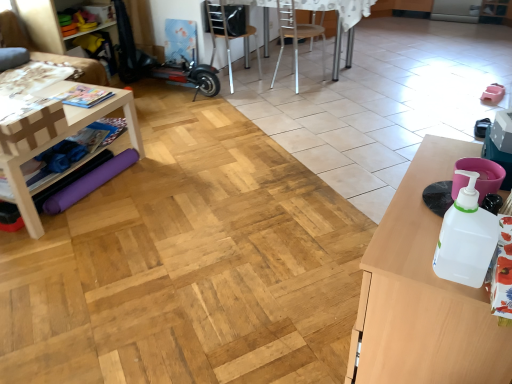
The width and height of the screenshot is (512, 384). Identify the location of brown fabric couch at left. (49, 53).

Identify the location of metallic silver table at center. (341, 8).

What is the approximate width of white wood table at left, marked as the first table in a back-to-front arrangement?

white wood table at left, marked as the first table in a back-to-front arrangement, is 21.96 inches in width.

Measure the distance between point (258, 61) and camera.

The depth of point (258, 61) is 4.50 meters.

Where is `white plastic bottle at right`? white plastic bottle at right is located at coordinates (466, 238).

Does point (447, 252) come behind point (93, 110)?

No, it is in front of (93, 110).

Where is `bottle in front of the white wood table at left, placed as the second table when sorted from right to left`? This screenshot has width=512, height=384. bottle in front of the white wood table at left, placed as the second table when sorted from right to left is located at coordinates (466, 238).

From the picture: Which of these two, white plastic bottle at right or white wood table at left, marked as the first table in a back-to-front arrangement, is smaller?

Smaller between the two is white plastic bottle at right.

Is white plastic bottle at right facing towards white wood table at left, marked as the first table in a back-to-front arrangement?

Yes, white plastic bottle at right is aimed at white wood table at left, marked as the first table in a back-to-front arrangement.

From a real-world perspective, is metallic silver chair at center, which ranks as the first chair in right-to-left order, beneath black plastic chair at center, the first chair in the left-to-right sequence?

Indeed, from a real-world perspective, metallic silver chair at center, which ranks as the first chair in right-to-left order, is positioned beneath black plastic chair at center, the first chair in the left-to-right sequence.

Does point (279, 0) come in front of point (212, 10)?

No, it is behind (212, 10).

Considering the sizes of metallic silver chair at center, which ranks as the first chair in right-to-left order, and black plastic chair at center, the first chair in the left-to-right sequence, in the image, is metallic silver chair at center, which ranks as the first chair in right-to-left order, taller or shorter than black plastic chair at center, the first chair in the left-to-right sequence,?

Clearly, metallic silver chair at center, which ranks as the first chair in right-to-left order, is taller compared to black plastic chair at center, the first chair in the left-to-right sequence.

Which is nearer, (379, 238) or (318, 26)?

The point (379, 238) is closer to the camera.

Is wooden table at right, marked as the 2th table in a back-to-front arrangement, bigger than metallic silver chair at center, the 2th chair in the left-to-right sequence?

Yes.

Which object is further away from the camera taking this photo, wooden table at right, marked as the first table in a front-to-back arrangement, or metallic silver chair at center, the 2th chair in the left-to-right sequence?

metallic silver chair at center, the 2th chair in the left-to-right sequence, is further away from the camera.

From the image's perspective, count 2nd tables downward from the metallic silver chair at center, which ranks as the first chair in right-to-left order, and point to it. Please provide its 2D coordinates.

[(423, 294)]

Is point (230, 84) less distant than point (323, 70)?

Yes, it is in front of point (323, 70).

Is metallic silver table at center facing towards metallic silver chair at center, which ranks as the first chair in right-to-left order?

Yes, metallic silver table at center is oriented towards metallic silver chair at center, which ranks as the first chair in right-to-left order.

Is metallic silver table at center inside the boundaries of metallic silver chair at center, which ranks as the first chair in right-to-left order, or outside?

metallic silver table at center is not enclosed by metallic silver chair at center, which ranks as the first chair in right-to-left order.

Does metallic silver table at center come in front of metallic silver chair at center, the 2th chair in the left-to-right sequence?

No, the depth of metallic silver table at center is greater than that of metallic silver chair at center, the 2th chair in the left-to-right sequence.

Which object is wider, white wood table at left, which is counted as the second table, starting from the front, or wooden table at right, marked as the 2th table in a back-to-front arrangement?

Wider between the two is white wood table at left, which is counted as the second table, starting from the front.

Where is `table that is above the white wood table at left, which is counted as the second table, starting from the front (from a real-world perspective)`? table that is above the white wood table at left, which is counted as the second table, starting from the front (from a real-world perspective) is located at coordinates (423, 294).

Considering the sizes of white wood table at left, placed as the second table when sorted from right to left, and wooden table at right, marked as the 2th table in a back-to-front arrangement, in the image, is white wood table at left, placed as the second table when sorted from right to left, taller or shorter than wooden table at right, marked as the 2th table in a back-to-front arrangement,?

In the image, white wood table at left, placed as the second table when sorted from right to left, appears to be shorter than wooden table at right, marked as the 2th table in a back-to-front arrangement.

Is there a large distance between white wood table at left, which is counted as the second table, starting from the front, and wooden table at right, marked as the first table in a front-to-back arrangement?

Yes, white wood table at left, which is counted as the second table, starting from the front, is far from wooden table at right, marked as the first table in a front-to-back arrangement.

Is metallic silver chair at center, which ranks as the first chair in right-to-left order, directly adjacent to brown fabric couch at left?

They are not placed beside each other.

From the image's perspective, which object appears higher, metallic silver chair at center, which ranks as the first chair in right-to-left order, or brown fabric couch at left?

From the image's view, brown fabric couch at left is above.

Relative to brown fabric couch at left, is metallic silver chair at center, the 2th chair in the left-to-right sequence, in front or behind?

Visually, metallic silver chair at center, the 2th chair in the left-to-right sequence, is located behind brown fabric couch at left.

Which is more distant, (320,33) or (78,67)?

Positioned behind is point (320,33).

Which of these two, white plastic bottle at right or metallic silver table at center, stands shorter?

white plastic bottle at right.

How different are the orientations of white plastic bottle at right and metallic silver table at center in degrees?

The angle between the facing direction of white plastic bottle at right and the facing direction of metallic silver table at center is 89.5 degrees.

In the image, is white plastic bottle at right positioned in front of or behind metallic silver table at center?

In the image, white plastic bottle at right appears in front of metallic silver table at center.

From a real-world perspective, which is physically below, white plastic bottle at right or metallic silver table at center?

metallic silver table at center is physically lower.

Find the location of `table that is the 2nd one below the white plastic bottle at right (from a real-world perspective)`. table that is the 2nd one below the white plastic bottle at right (from a real-world perspective) is located at coordinates (55, 142).

This screenshot has height=384, width=512. What are the coordinates of `chair to the left of metallic silver chair at center, the 2th chair in the left-to-right sequence` in the screenshot? It's located at (228, 35).

Based on their spatial positions, is brown fabric couch at left or white plastic bottle at right further from metallic silver table at center?

Based on the image, white plastic bottle at right appears to be further to metallic silver table at center.

Which object lies further to the anchor point black plastic chair at center, which appears as the second chair when viewed from the right, wooden table at right, which is the 2th table in left-to-right order, or white plastic bottle at right?

Among the two, white plastic bottle at right is located further to black plastic chair at center, which appears as the second chair when viewed from the right.

Estimate the real-world distances between objects in this image. Which object is closer to brown fabric couch at left, metallic silver chair at center, the 2th chair in the left-to-right sequence, or white wood table at left, which is counted as the second table, starting from the front?

Based on the image, white wood table at left, which is counted as the second table, starting from the front, appears to be nearer to brown fabric couch at left.

Consider the image. Which object lies further to the anchor point metallic silver chair at center, which ranks as the first chair in right-to-left order, metallic silver table at center or brown fabric couch at left?

brown fabric couch at left is further to metallic silver chair at center, which ranks as the first chair in right-to-left order.

Which object lies nearer to the anchor point white plastic bottle at right, metallic silver chair at center, the 2th chair in the left-to-right sequence, or metallic silver table at center?

The object closer to white plastic bottle at right is metallic silver table at center.

Estimate the real-world distances between objects in this image. Which object is closer to metallic silver table at center, metallic silver chair at center, which ranks as the first chair in right-to-left order, or wooden table at right, marked as the first table in a front-to-back arrangement?

Among the two, metallic silver chair at center, which ranks as the first chair in right-to-left order, is located nearer to metallic silver table at center.

Based on their spatial positions, is brown fabric couch at left or black plastic chair at center, the first chair in the left-to-right sequence, closer to metallic silver chair at center, the 2th chair in the left-to-right sequence?

black plastic chair at center, the first chair in the left-to-right sequence, is closer to metallic silver chair at center, the 2th chair in the left-to-right sequence.

Based on their spatial positions, is white plastic bottle at right or white wood table at left, the first table positioned from the left, closer to black plastic chair at center, which appears as the second chair when viewed from the right?

white wood table at left, the first table positioned from the left, is closer to black plastic chair at center, which appears as the second chair when viewed from the right.

Find the location of `chair positioned between wooden table at right, marked as the 2th table in a back-to-front arrangement, and black plastic chair at center, which appears as the second chair when viewed from the right, from near to far`. chair positioned between wooden table at right, marked as the 2th table in a back-to-front arrangement, and black plastic chair at center, which appears as the second chair when viewed from the right, from near to far is located at coordinates (297, 36).

Locate an element on the screen. This screenshot has width=512, height=384. couch between white plastic bottle at right and metallic silver table at center along the z-axis is located at coordinates [49, 53].

Locate an element on the screen. The height and width of the screenshot is (384, 512). table between brown fabric couch at left and metallic silver chair at center, which ranks as the first chair in right-to-left order, in the horizontal direction is located at coordinates (55, 142).

Locate an element on the screen. Image resolution: width=512 pixels, height=384 pixels. chair between brown fabric couch at left and metallic silver chair at center, the 2th chair in the left-to-right sequence, in the horizontal direction is located at coordinates (228, 35).